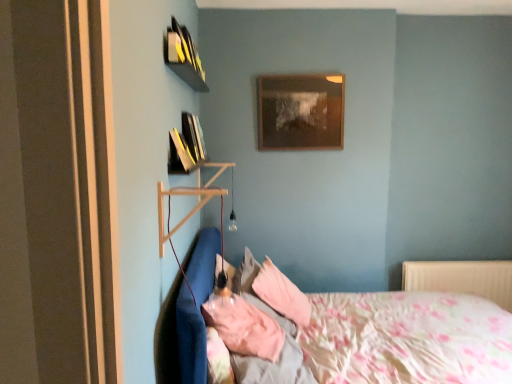
Question: Is point (452, 284) positioned closer to the camera than point (320, 132)?

Choices:
 (A) farther
 (B) closer

Answer: (A)

Question: Is white plastic radiator at lower right taller or shorter than wooden picture frame at upper center?

Choices:
 (A) tall
 (B) short

Answer: (B)

Question: Which of these objects is positioned farthest from the pink fabric pillow at center, arranged as the first pillow when viewed from the back?

Choices:
 (A) fluffy cotton bed at lower left
 (B) pink fabric pillow at center, positioned as the first pillow in front-to-back order
 (C) white plastic radiator at lower right
 (D) hardcover books at upper left, which ranks as the 1th book in bottom-to-top order
 (E) yellow matte book at upper left, which appears as the 1th book when viewed from the top

Answer: (E)

Question: Which object is positioned farthest from the hardcover books at upper left, which ranks as the 2th book in top-to-bottom order?

Choices:
 (A) wooden picture frame at upper center
 (B) pink fabric pillow at center, which is the 2th pillow from front to back
 (C) yellow matte book at upper left, the second book from the bottom
 (D) pink fabric pillow at center, positioned as the first pillow in front-to-back order
 (E) fluffy cotton bed at lower left

Answer: (E)